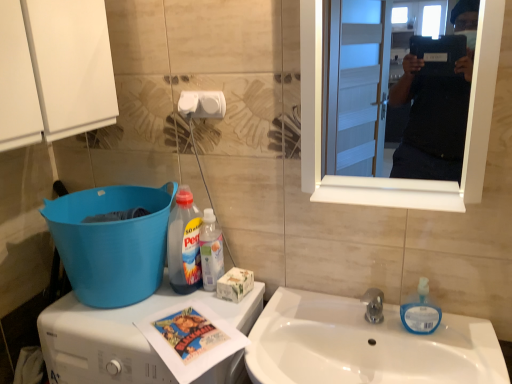
I want to click on free space to the right of blue translucent soap dispenser at sink right, so click(x=468, y=334).